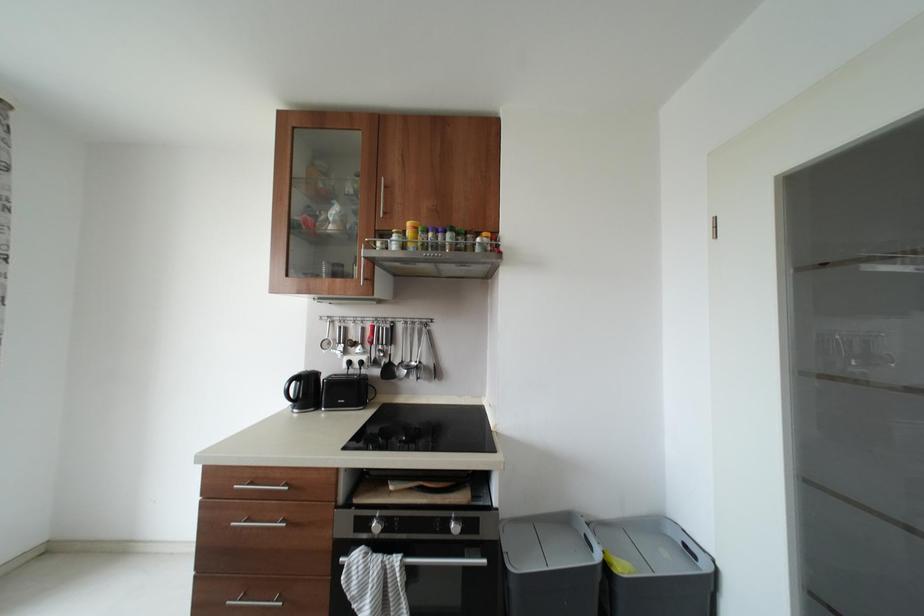
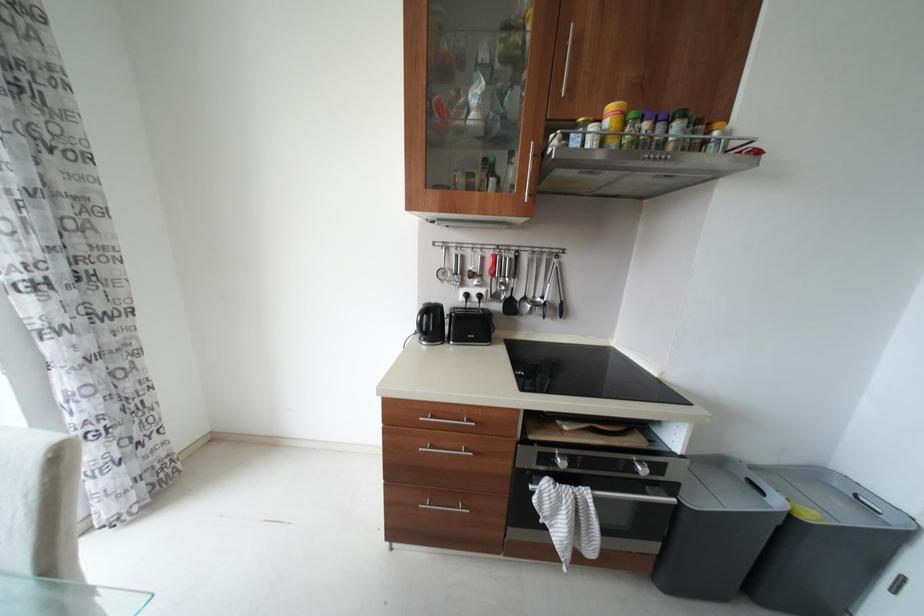
Question: The first image is from the beginning of the video and the second image is from the end. How did the camera likely rotate when shooting the video?

Choices:
 (A) Left
 (B) Right
 (C) Up
 (D) Down

Answer: (D)